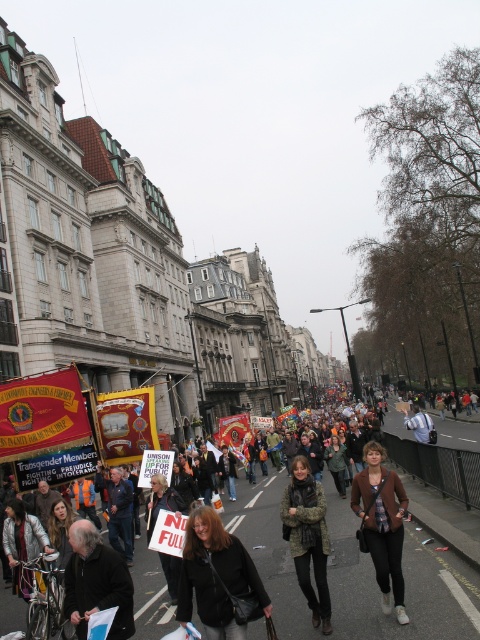
Question: Based on their relative distances, which object is nearer to the black leather jacket at center?

Choices:
 (A) white fabric sign at center
 (B) brown fabric jacket at center

Answer: (A)

Question: Is brown fabric jacket at center wider than white fabric sign at center?

Choices:
 (A) no
 (B) yes

Answer: (A)

Question: Can you confirm if camouflage jacket at center is positioned to the right of white fabric sign at center?

Choices:
 (A) yes
 (B) no

Answer: (A)

Question: Estimate the real-world distances between objects in this image. Which object is closer to the brown fabric jacket at center?

Choices:
 (A) camouflage jacket at center
 (B) white fabric sign at center

Answer: (A)

Question: Which object is positioned farthest from the black leather jacket at center?

Choices:
 (A) white fabric sign at center
 (B) dark gray jacket at lower left
 (C) brown fabric jacket at center
 (D) camouflage jacket at center

Answer: (C)

Question: Can you confirm if brown fabric jacket at center is positioned above camouflage jacket at center?

Choices:
 (A) yes
 (B) no

Answer: (A)